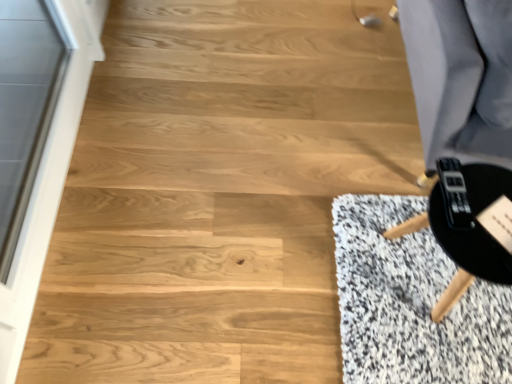
The width and height of the screenshot is (512, 384). In order to click on vacant point to the left of black matte round table at lower right in this screenshot , I will do `click(353, 274)`.